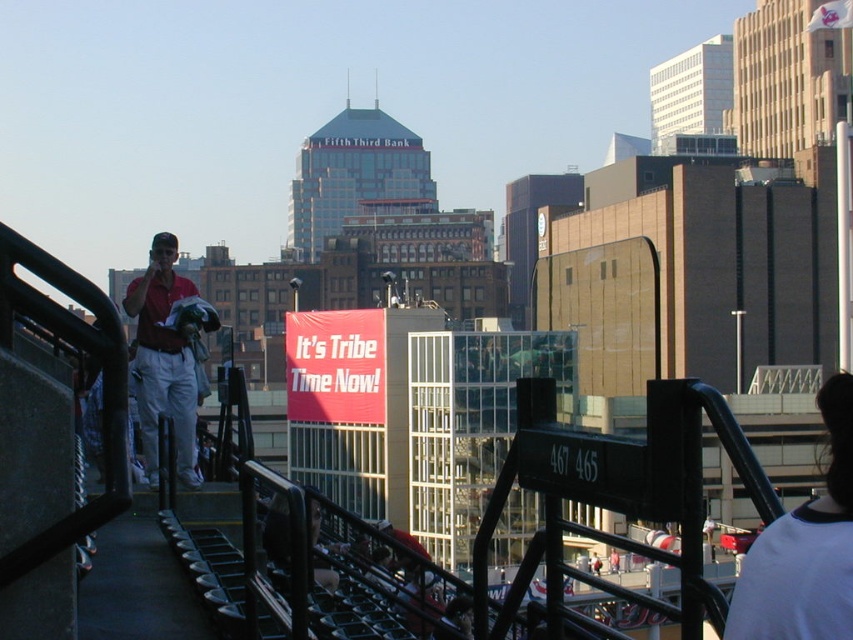
Question: Can you confirm if white jersey at upper right is positioned to the left of matte red shirt at left?

Choices:
 (A) yes
 (B) no

Answer: (B)

Question: Is white jersey at upper right to the right of matte red shirt at left from the viewer's perspective?

Choices:
 (A) yes
 (B) no

Answer: (A)

Question: In this image, where is white jersey at upper right located relative to matte red shirt at left?

Choices:
 (A) above
 (B) below

Answer: (B)

Question: Which of the following is the farthest from the observer?

Choices:
 (A) (843, 625)
 (B) (161, 362)

Answer: (B)

Question: Which point appears closest to the camera in this image?

Choices:
 (A) (828, 436)
 (B) (144, 369)

Answer: (B)